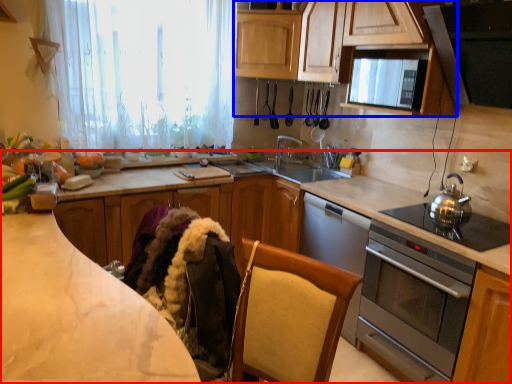
Question: Which object appears farthest to the camera in this image, countertop (highlighted by a red box) or cabinetry (highlighted by a blue box)?

Choices:
 (A) countertop
 (B) cabinetry

Answer: (A)